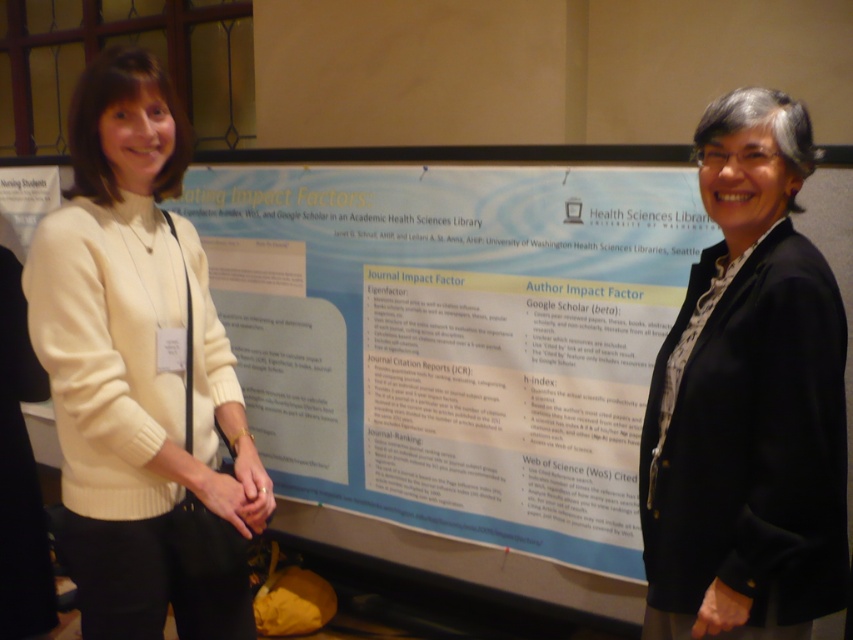
What are the coordinates of the creamy wool sweater at left in the image?

The creamy wool sweater at left is located at coordinates point (137, 365).

You are organizing a photo shoot and need to ensure that the clothing items in the image are displayed proportionally. Given that the creamy wool sweater at left is larger in size than the black textured blazer at right, which clothing item would you adjust to maintain visual balance?

To maintain visual balance, you would need to adjust the black textured blazer at right, as it is smaller in size compared to the creamy wool sweater at left. Perhaps enlarging it slightly or positioning it in a way that its smaller size is balanced by its placement.